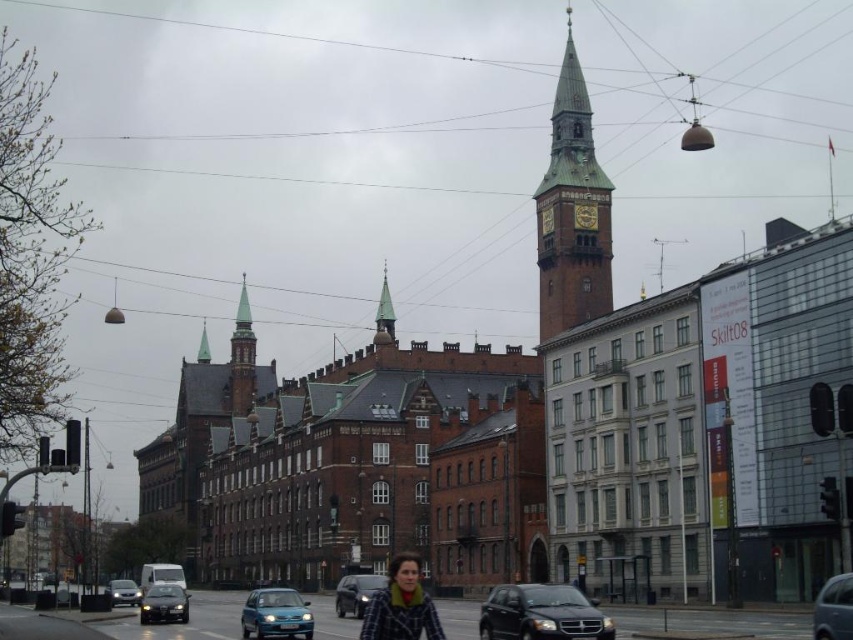
You are standing at the point with coordinates point (276,614). What object are you standing on?

You are standing on the blue metallic car at lower center.

You are a pedestrian standing on the sidewalk and want to cross the street to reach the modern glass building on the right. There is a blue metallic car at lower center and a green copper spire at center. Which object should you avoid while crossing?

You should avoid the blue metallic car at lower center because it is positioned under the green copper spire at center, meaning it is closer to the sidewalk and in your path.

You are a pedestrian standing at the crosswalk and want to cross the street safely. You see a blue metallic car at lower center and a metallic silver car at lower right. Which car is closer to the crosswalk?

The blue metallic car at lower center is closer to the crosswalk because it is located below the metallic silver car at lower right, indicating it is positioned lower in the image and thus nearer to the crosswalk area.